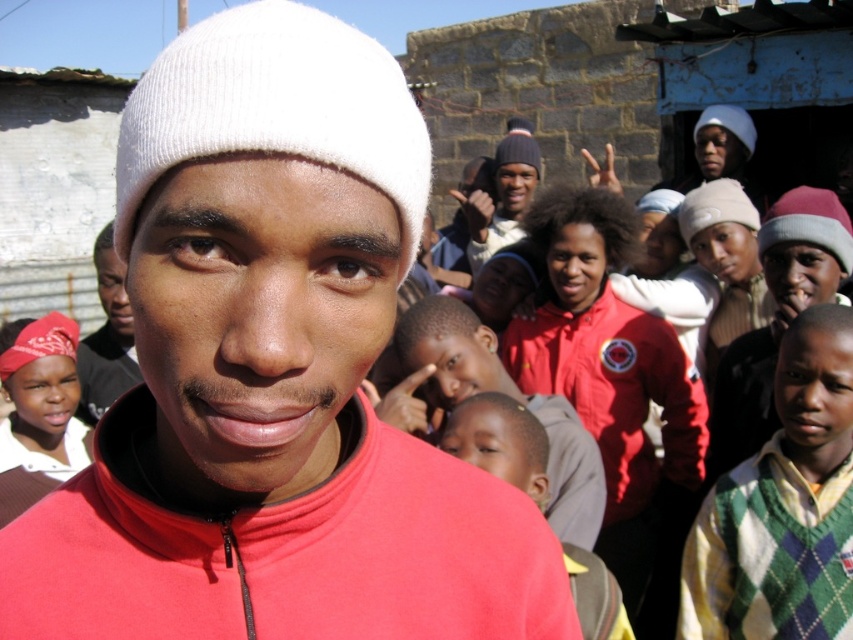
Question: Is matte red jacket at center wider than matte red bandana at lower left?

Choices:
 (A) no
 (B) yes

Answer: (B)

Question: Can you confirm if matte red jacket at center is smaller than matte red bandana at lower left?

Choices:
 (A) no
 (B) yes

Answer: (A)

Question: Which of the following is the closest to the observer?

Choices:
 (A) matte red jacket at center
 (B) matte red bandana at lower left

Answer: (A)

Question: Which of these objects is positioned farthest from the matte red jacket at center?

Choices:
 (A) knitted gray beanie at center
 (B) green argyle sweater at right
 (C) matte red bandana at lower left
 (D) smooth skin child at center

Answer: (A)

Question: In this image, where is matte red bandana at lower left located relative to knitted gray beanie at center?

Choices:
 (A) left
 (B) right

Answer: (A)

Question: Among these points, which one is nearest to the camera?

Choices:
 (A) (488, 205)
 (B) (534, 442)

Answer: (B)